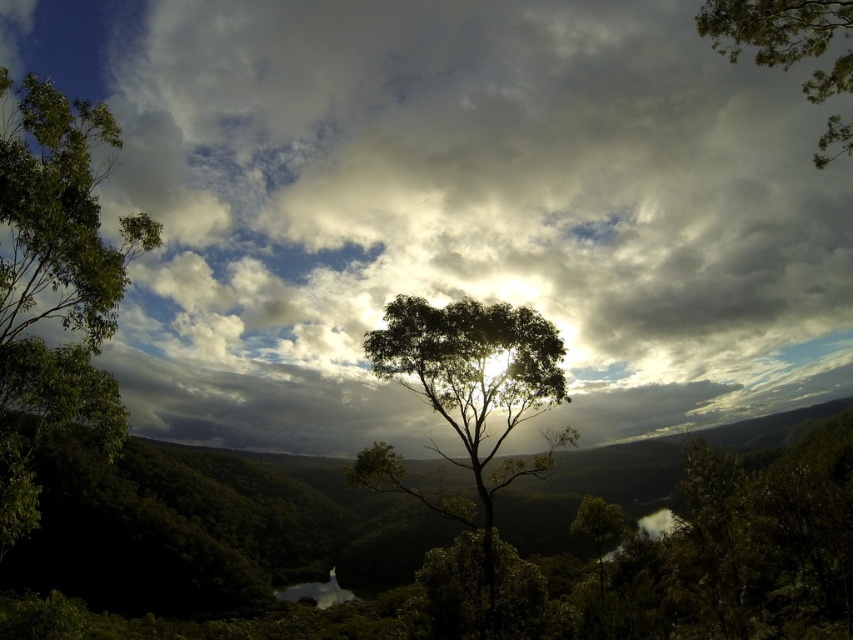
Question: Can you confirm if cloudy sky at upper center is positioned above green leafy tree at left?

Choices:
 (A) yes
 (B) no

Answer: (A)

Question: Which point is farther to the camera?

Choices:
 (A) (59, 272)
 (B) (844, 150)
 (C) (283, 433)
 (D) (419, 301)

Answer: (C)

Question: Does green leafy tree at left have a larger size compared to green leafy tree at upper right?

Choices:
 (A) no
 (B) yes

Answer: (B)

Question: Does cloudy sky at upper center appear on the right side of green leafy tree at left?

Choices:
 (A) no
 (B) yes

Answer: (A)

Question: Which object is positioned farthest from the green leafy tree at left?

Choices:
 (A) cloudy sky at upper center
 (B) green leafy tree at center
 (C) green leafy tree at upper right

Answer: (A)

Question: Among these points, which one is nearest to the camera?

Choices:
 (A) (488, 554)
 (B) (846, 26)
 (C) (64, 422)
 (D) (296, 360)

Answer: (C)